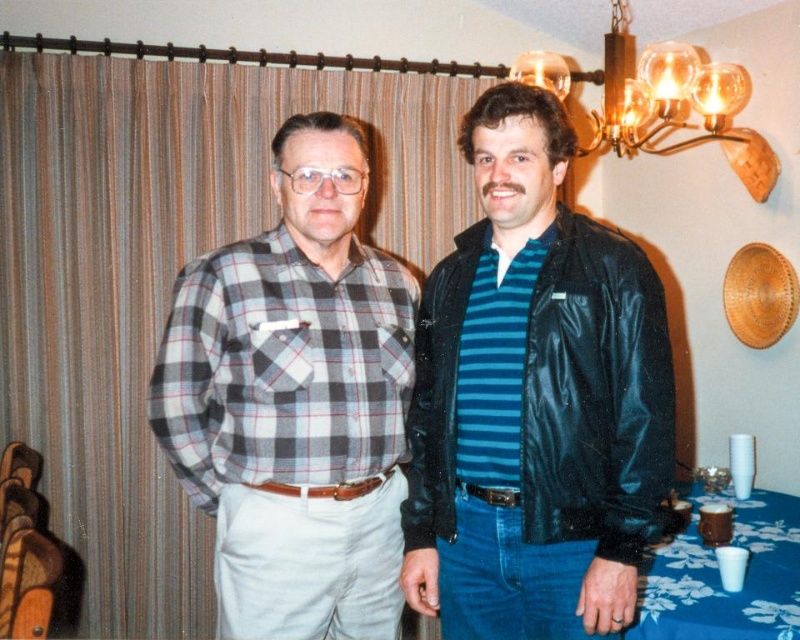
You are standing in a room with two points marked on the wall. The first point is at coordinates point (620, 266) and the second is at point (328, 508). Which point is closer to you?

Point (620, 266) is closer to the viewer than point (328, 508).

You are organizing a small gathering and need to decide which item takes up more horizontal space. Which one is wider between the plaid flannel shirt at center and the blue floral tablecloth at lower right?

The plaid flannel shirt at center is wider than the blue floral tablecloth at lower right according to the description.

You are a photographer setting up a shoot in this room. You need to position a light source between the plaid cotton shirt at center and the black shiny leather jacket at right. Which object should the light be placed closer to to ensure it illuminates the closer object properly?

The plaid cotton shirt at center is closer to the viewer than the black shiny leather jacket at right. Therefore, the light source should be placed closer to the plaid cotton shirt at center to properly illuminate it.